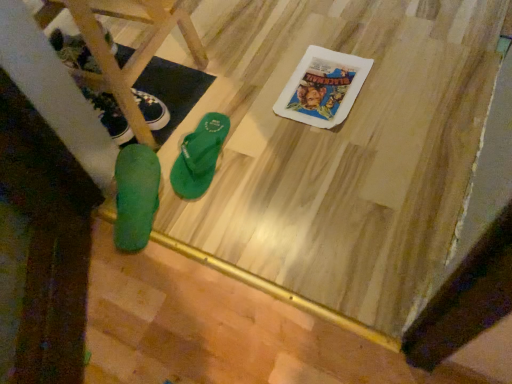
Where is `free space to the back side of green rubber flip-flop at center, the third footwear positioned from the left`? Image resolution: width=512 pixels, height=384 pixels. free space to the back side of green rubber flip-flop at center, the third footwear positioned from the left is located at coordinates (200, 102).